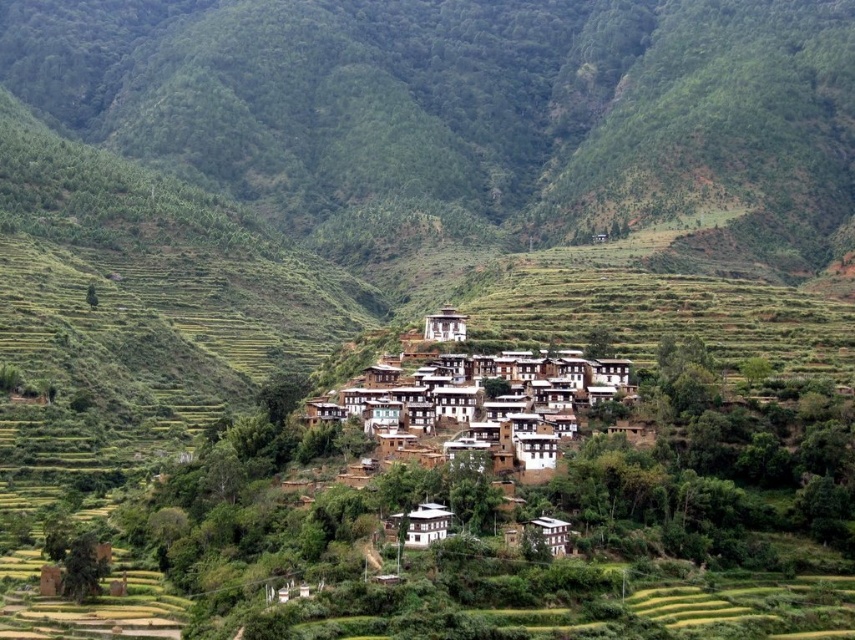
Question: Which object appears closest to the camera in this image?

Choices:
 (A) green grassy hillside at center
 (B) white stucco village at center

Answer: (B)

Question: Which object appears farthest from the camera in this image?

Choices:
 (A) green grassy hillside at center
 (B) white stucco village at center

Answer: (A)

Question: Is the position of green grassy hillside at center less distant than that of white stucco village at center?

Choices:
 (A) no
 (B) yes

Answer: (A)

Question: Can you confirm if green grassy hillside at center is wider than white stucco village at center?

Choices:
 (A) no
 (B) yes

Answer: (B)

Question: Is green grassy hillside at center thinner than white stucco village at center?

Choices:
 (A) no
 (B) yes

Answer: (A)